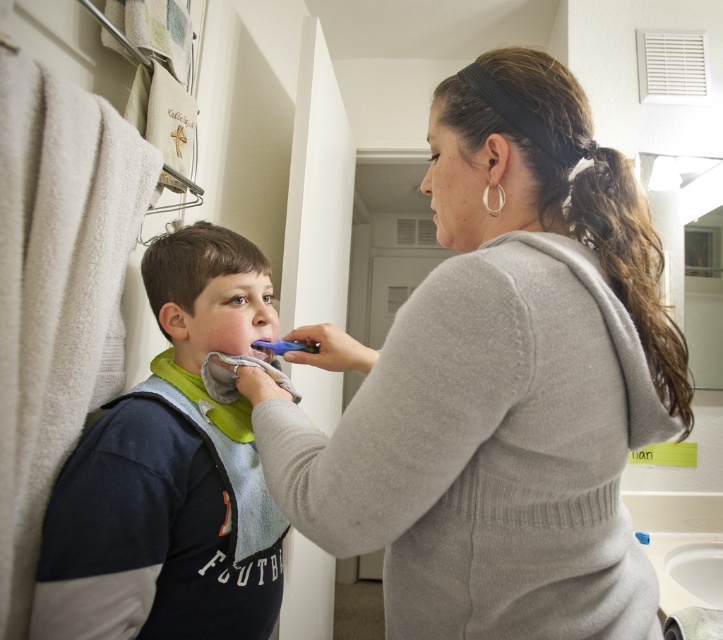
Question: Is matte gray sweater at center thinner than dark blue cotton shirt at left?

Choices:
 (A) no
 (B) yes

Answer: (A)

Question: Where is matte gray sweater at center located in relation to blue plastic toothbrush at lower center in the image?

Choices:
 (A) left
 (B) right

Answer: (B)

Question: From the image, what is the correct spatial relationship of blue plastic toothbrush at lower center in relation to smooth skin at center?

Choices:
 (A) right
 (B) left

Answer: (B)

Question: Which point appears farthest from the camera in this image?

Choices:
 (A) (688, 426)
 (B) (102, 490)

Answer: (B)

Question: Which object is farther from the camera taking this photo?

Choices:
 (A) dark blue cotton shirt at left
 (B) smooth skin at center
 (C) matte gray sweater at center

Answer: (B)

Question: Which point appears farthest from the camera in this image?

Choices:
 (A) (257, 342)
 (B) (435, 221)
 (C) (61, 538)
 (D) (484, 436)

Answer: (B)